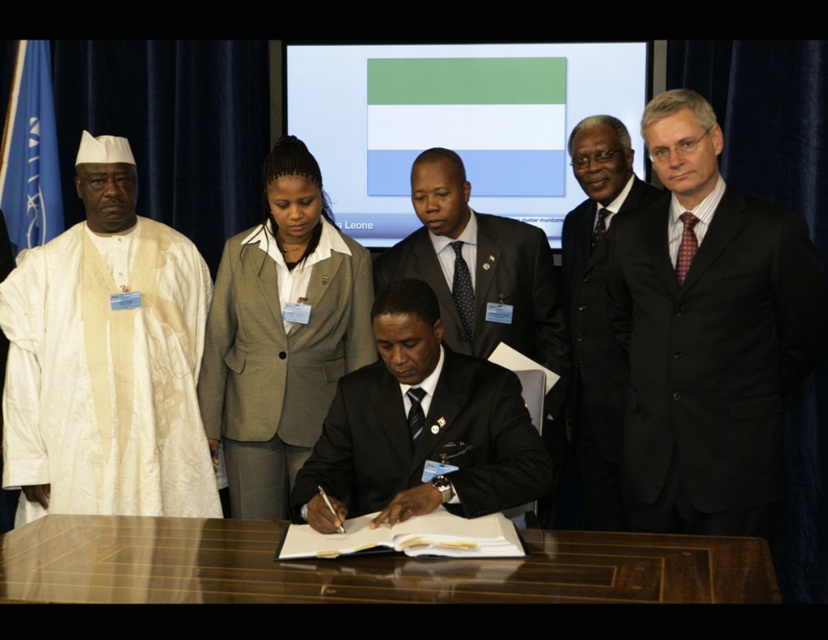
You are a photographer at the signing ceremony. You need to capture a photo of both the dark blue pinstripe suit at center and the gray woolen blazer at center. Based on their positions, which one is on the right side when facing the scene?

The dark blue pinstripe suit at center is positioned on the right side of gray woolen blazer at center, so when facing the scene, the dark blue pinstripe suit at center is on the right side.

You are attending a formal signing ceremony and need to locate the black suit at right and the white cloth at left. Based on their positions, which one is closer to the center of the room?

The white cloth at left is closer to the center of the room because the black suit at right is positioned to its right, meaning the white cloth at left is nearer to the middle.